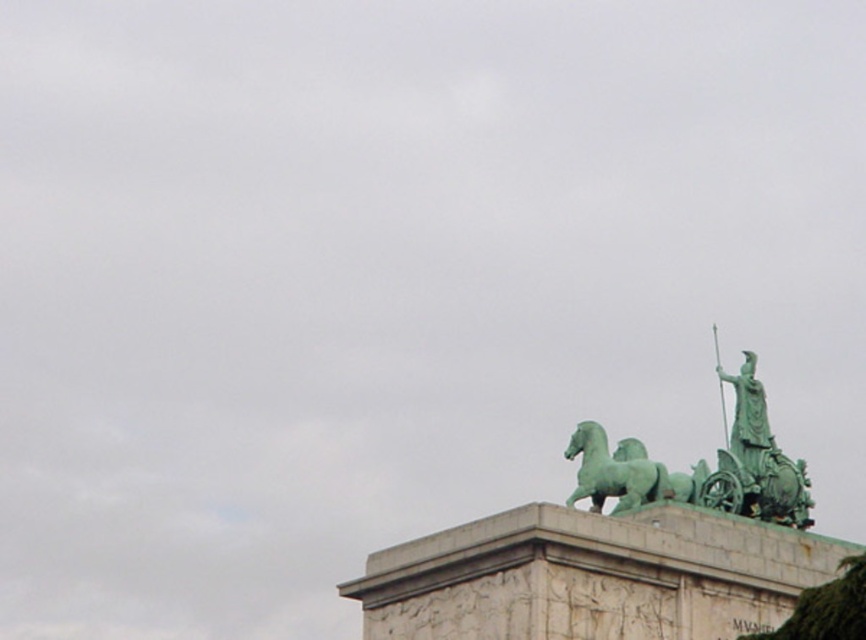
Based on the photo, is green polished metal chariot at upper right taller than green mossy tree at lower right?

Indeed, green polished metal chariot at upper right has a greater height compared to green mossy tree at lower right.

Is green polished metal chariot at upper right bigger than green mossy tree at lower right?

Yes.

What do you see at coordinates (705, 465) in the screenshot?
I see `green polished metal chariot at upper right` at bounding box center [705, 465].

I want to click on green polished metal chariot at upper right, so [x=705, y=465].

Which is in front, point (645, 460) or point (843, 620)?

Point (843, 620) is in front.

Who is higher up, green polished stone horse at upper center or green mossy tree at lower right?

green polished stone horse at upper center

Does point (638, 474) lie in front of point (812, 609)?

That is False.

Identify the location of green polished stone horse at upper center. (612, 472).

Which is above, green polished metal chariot at upper right or green patinated bronze chariot at upper right?

green polished metal chariot at upper right

Which of these two, green polished metal chariot at upper right or green patinated bronze chariot at upper right, stands shorter?

green polished metal chariot at upper right

Between point (624, 483) and point (802, 461), which one is positioned behind?

The point (802, 461) is more distant.

Find the location of `green polished metal chariot at upper right`. green polished metal chariot at upper right is located at coordinates (705, 465).